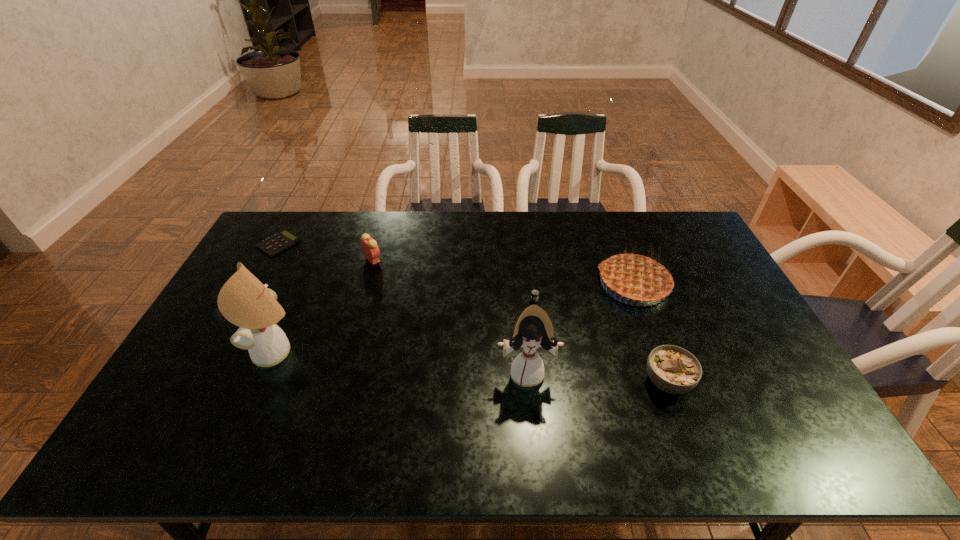
Find the location of `doll located in the near edge section of the desktop`. doll located in the near edge section of the desktop is located at coordinates (534, 329).

The height and width of the screenshot is (540, 960). I want to click on soup bowl that is at the near edge, so click(x=674, y=370).

The height and width of the screenshot is (540, 960). I want to click on object present at the left edge, so click(x=276, y=243).

Locate an element on the screen. This screenshot has height=540, width=960. object that is at the far left corner is located at coordinates (276, 243).

Where is `free region at the far edge of the desktop`? free region at the far edge of the desktop is located at coordinates (581, 217).

Locate an element on the screen. The height and width of the screenshot is (540, 960). free space at the near edge of the desktop is located at coordinates (274, 393).

The width and height of the screenshot is (960, 540). Identify the location of vacant space at the left edge of the desktop. (228, 375).

The height and width of the screenshot is (540, 960). Find the location of `vacant area at the far right corner`. vacant area at the far right corner is located at coordinates (682, 219).

Where is `free area in between the beer can and the third shortest object`? free area in between the beer can and the third shortest object is located at coordinates (601, 341).

At what (x,y) coordinates should I click in order to perform the action: click on free space that is in between the pie and the third object from left to right. Please return your answer as a coordinate pair (x, y). Image resolution: width=960 pixels, height=540 pixels. Looking at the image, I should click on (503, 272).